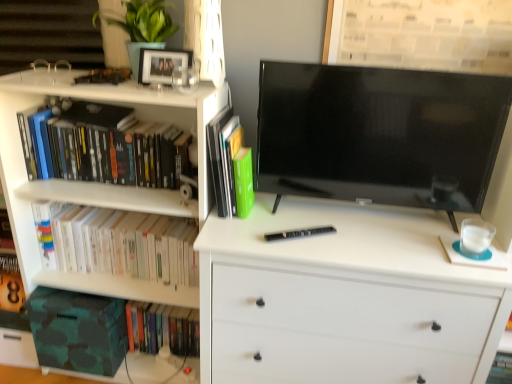
The width and height of the screenshot is (512, 384). Find the location of `vacant space to the right of black matte pen at center`. vacant space to the right of black matte pen at center is located at coordinates (352, 241).